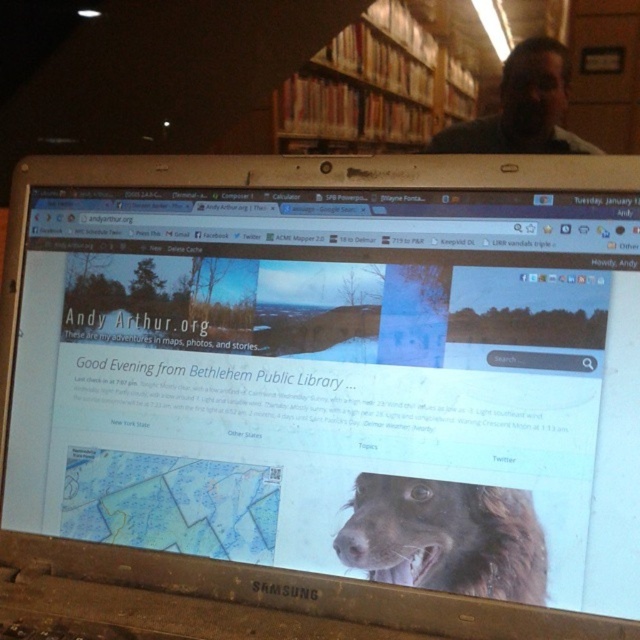
From the picture: You are a photographer standing 1.2 meters away from the wooden bookshelf at upper center. Can you reach it without moving your feet?

The wooden bookshelf at upper center is 1.13 meters from camera. Since you are standing 1.2 meters away, you can just barely reach it without moving your feet.

You are a visitor at the library and want to take a photo of the wooden bookshelf at upper center and the brown furry dog at center displayed on the laptop screen. Which object should you focus on first if you want to capture both in one shot without moving the camera?

The wooden bookshelf at upper center is much taller than the brown furry dog at center, so you should focus on the wooden bookshelf at upper center first to ensure both are in frame.